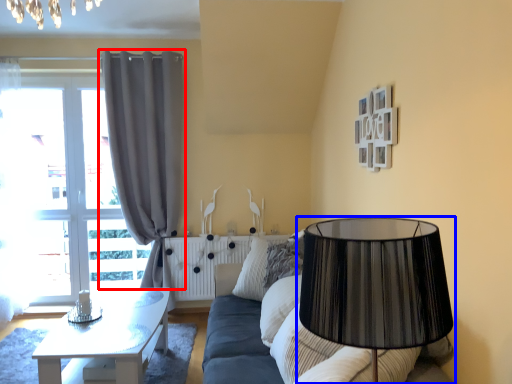
Question: Among these objects, which one is nearest to the camera, curtain (highlighted by a red box) or lamp (highlighted by a blue box)?

Choices:
 (A) curtain
 (B) lamp

Answer: (B)